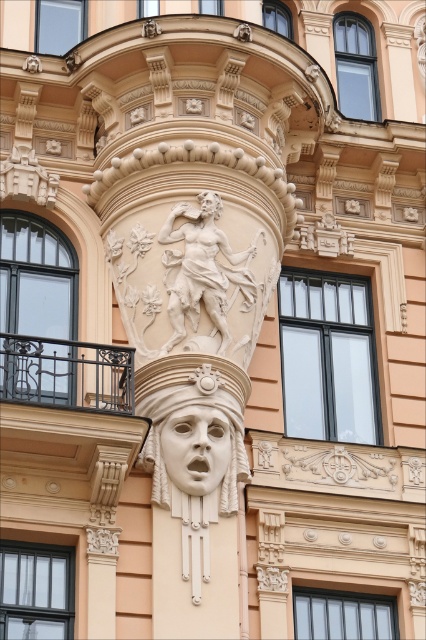
Which of these two, white stone mask at center or white stone face at center, stands shorter?

Standing shorter between the two is white stone mask at center.

Between white stone mask at center and white stone face at center, which one appears on the right side from the viewer's perspective?

Positioned to the right is white stone face at center.

Locate an element on the screen. The height and width of the screenshot is (640, 426). white stone mask at center is located at coordinates (192, 408).

How far apart are white stone mask at center and white marble statue at center?

They are 5.92 feet apart.

Can you confirm if white stone mask at center is wider than white marble statue at center?

Correct, the width of white stone mask at center exceeds that of white marble statue at center.

Is point (164, 362) in front of point (178, 298)?

Yes, it is in front of point (178, 298).

The height and width of the screenshot is (640, 426). Identify the location of white stone mask at center. (192, 408).

Between white marble statue at center and white marble head at center, which one has less height?

Standing shorter between the two is white marble head at center.

Is point (186, 264) farther from viewer compared to point (204, 208)?

No.

Image resolution: width=426 pixels, height=640 pixels. In order to click on white marble statue at center in this screenshot , I will do pyautogui.click(x=203, y=269).